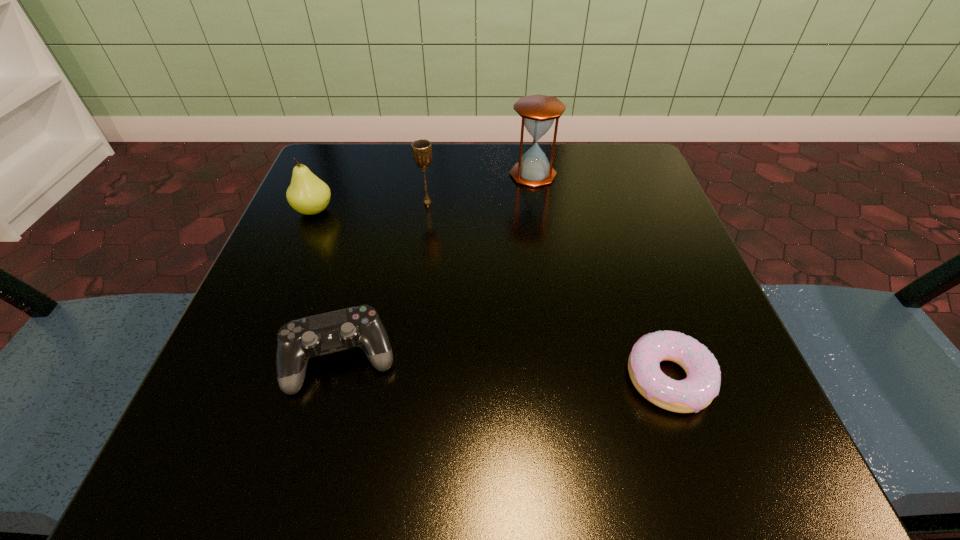
You are a GUI agent. You are given a task and a screenshot of the screen. Output one action in this format:
    pyautogui.click(x=<x>, y=<y>)
    Task: Click on the vacant space at the far edge of the desktop
    Image resolution: width=960 pixels, height=540 pixels.
    Given the screenshot: What is the action you would take?
    pyautogui.click(x=511, y=145)

Find the location of `vacant space at the near edge`. vacant space at the near edge is located at coordinates (540, 418).

Locate an element on the screen. This screenshot has height=540, width=960. free space at the left edge of the desktop is located at coordinates (286, 237).

Locate an element on the screen. The height and width of the screenshot is (540, 960). free space at the right edge of the desktop is located at coordinates (688, 303).

Find the location of a particular element. free space at the far left corner is located at coordinates pyautogui.click(x=339, y=176).

In the image, there is a desktop. Where is `vacant area at the near left corner`? Image resolution: width=960 pixels, height=540 pixels. vacant area at the near left corner is located at coordinates (201, 465).

Image resolution: width=960 pixels, height=540 pixels. I want to click on vacant area at the far right corner of the desktop, so click(588, 163).

Locate an element on the screen. free spot between the doughnut and the hourglass is located at coordinates (601, 276).

Locate an element on the screen. Image resolution: width=960 pixels, height=540 pixels. blank region between the farthest object and the control is located at coordinates (438, 267).

Where is `free space between the second shortest object and the leftmost object`? The image size is (960, 540). free space between the second shortest object and the leftmost object is located at coordinates (327, 285).